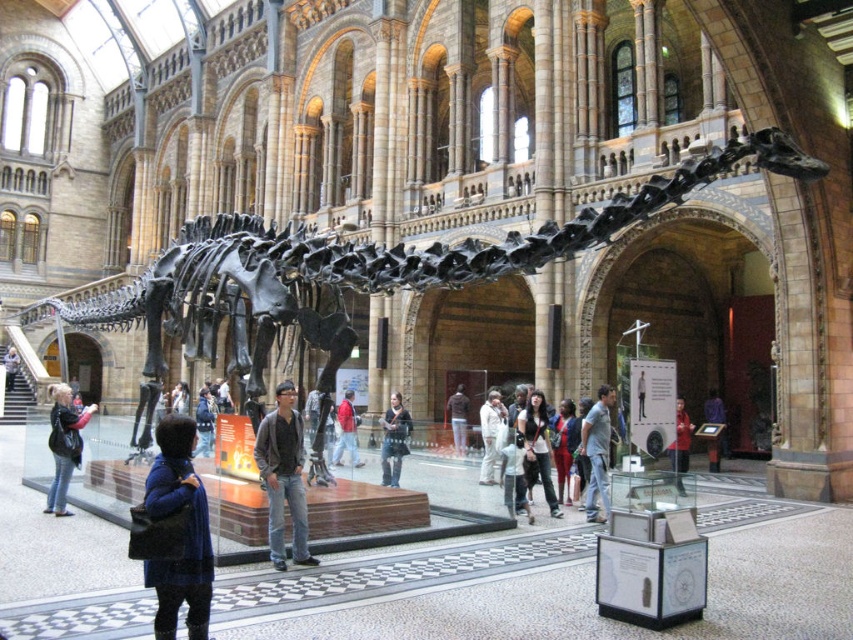
You are a security guard in the museum and need to ensure that the dark blue jeans at center and the dark blue jacket at center are within the restricted area. The restricted area has a minimum width requirement of 1.2 meters. Can both items be placed side by side within the restricted area without exceeding the width limit?

The dark blue jeans at center is wider than the dark blue jacket at center. However, since the exact widths are not provided, we cannot determine if their combined width exceeds 1.2 meters. Additional measurements are needed.

You are a visitor in the museum and you see both the purple fabric bag at center and the red fabric jacket at center. Which one is narrower?

The purple fabric bag at center is narrower than the red fabric jacket at center.

You are a visitor in the museum and want to take a photo of the red fabric jacket at center without the denim jacket at lower left appearing in the frame. Is this possible given their positions?

The denim jacket at lower left is located below the red fabric jacket at center, so if you position yourself to frame the red fabric jacket at center higher in the shot, the denim jacket at lower left should not be visible.